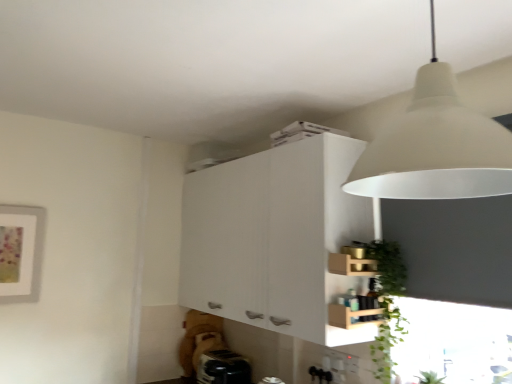
Question: Relative to black plastic toaster at lower center, is wooden crate at lower right in front or behind?

Choices:
 (A) behind
 (B) front

Answer: (B)

Question: Considering the relative positions of wooden crate at lower right and black plastic toaster at lower center in the image provided, is wooden crate at lower right to the left or to the right of black plastic toaster at lower center?

Choices:
 (A) right
 (B) left

Answer: (A)

Question: Which of these objects is positioned closest to the white matte lampshade at upper right?

Choices:
 (A) white matte cabinet at upper center
 (B) green leafy plant at lower right
 (C) black plastic toaster at lower center
 (D) wooden crate at lower right

Answer: (D)

Question: Considering the real-world distances, which object is closest to the black plastic toaster at lower center?

Choices:
 (A) white matte cabinet at upper center
 (B) green leafy plant at lower right
 (C) wooden crate at lower right
 (D) white matte lampshade at upper right

Answer: (A)